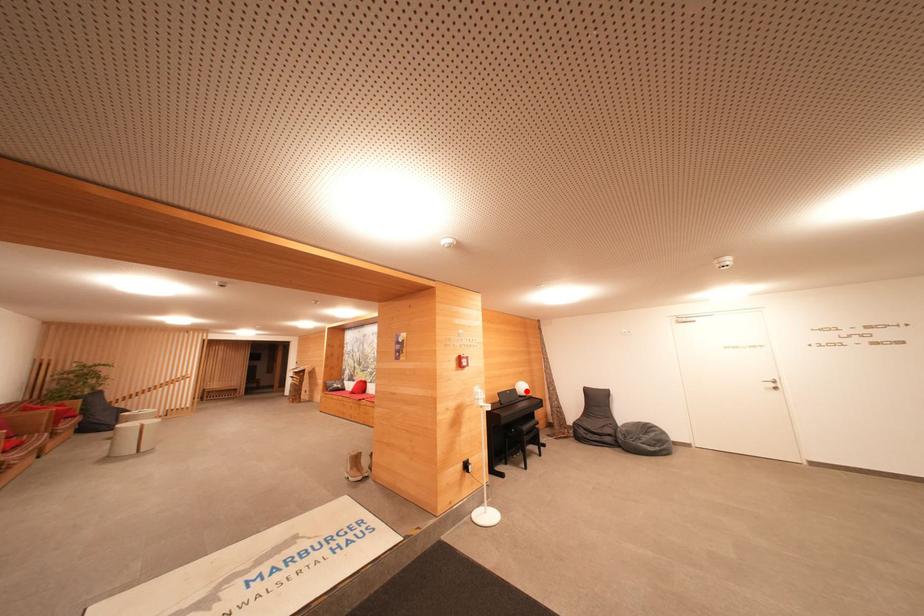
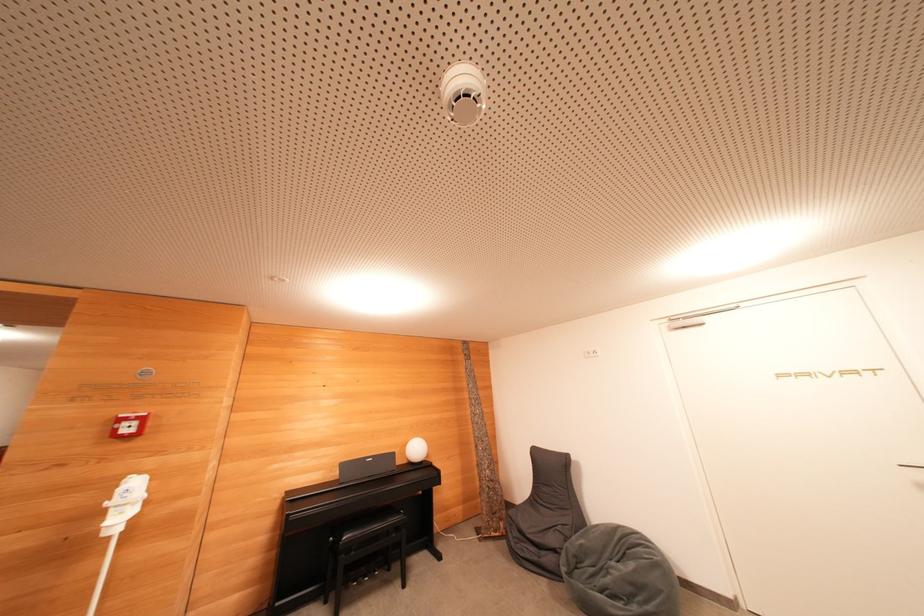
The point at the highlighted location is marked in the first image. Where is the corresponding point in the second image?

(419, 453)